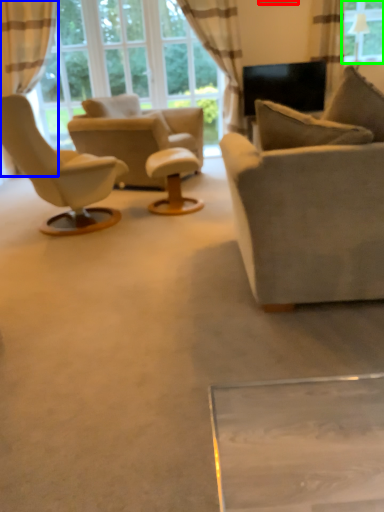
Question: Considering the real-world distances, which object is closest to picture frame (highlighted by a red box)? curtain (highlighted by a blue box) or window (highlighted by a green box).

Choices:
 (A) curtain
 (B) window

Answer: (B)